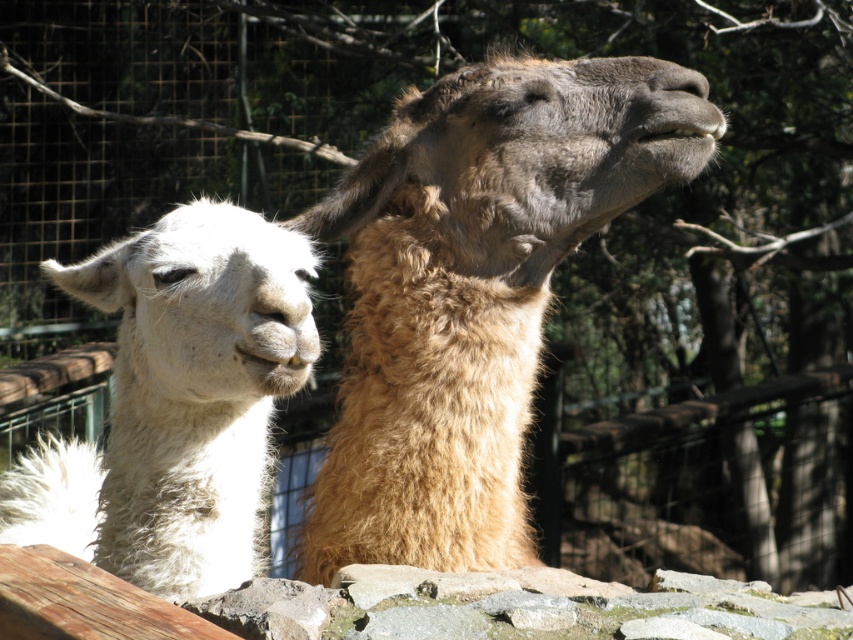
You are a zookeeper who needs to feed the fuzzy brown alpaca at upper center and the white fluffy alpaca at left. If you stand exactly between them, will you be closer to the fence or the trees behind the fence?

The fuzzy brown alpaca at upper center is 16.16 inches from the white fluffy alpaca at left. Since you are standing exactly between them, you are positioned halfway between the two animals. However, the description does not provide information about their distance from the fence or trees, so it is impossible to determine whether you would be closer to the fence or the trees behind the fence based on the given information.

You are a zookeeper observing the alpacas. You need to separate them into two different feeding areas. The white fluffy alpaca at left must be moved to the left feeding area, and the fuzzy brown alpaca at upper center must be moved to the right feeding area. Based on their current positions, which alpaca is closer to its designated feeding area?

The white fluffy alpaca at left is already positioned to the left, so it is closer to the left feeding area. The fuzzy brown alpaca at upper center is to the right of the white one, meaning it is closer to the right feeding area.